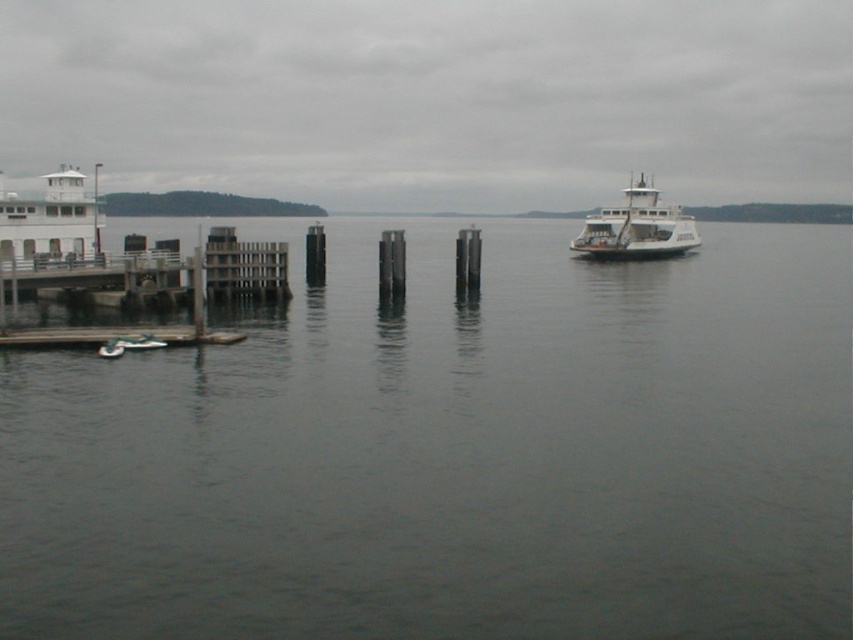
Question: Is white matte ferry at center thinner than white matte ferry at right?

Choices:
 (A) yes
 (B) no

Answer: (B)

Question: Among these points, which one is nearest to the camera?

Choices:
 (A) (432, 513)
 (B) (466, 129)

Answer: (A)

Question: Is white matte ferry at center wider than white matte ferry at right?

Choices:
 (A) no
 (B) yes

Answer: (B)

Question: Which point is closer to the camera taking this photo?

Choices:
 (A) (77, 621)
 (B) (636, 188)

Answer: (A)

Question: Estimate the real-world distances between objects in this image. Which object is farther from the white matte ferry at right?

Choices:
 (A) gray water at center
 (B) white matte ferry at center

Answer: (B)

Question: Does gray water at center have a larger size compared to white matte ferry at center?

Choices:
 (A) no
 (B) yes

Answer: (A)